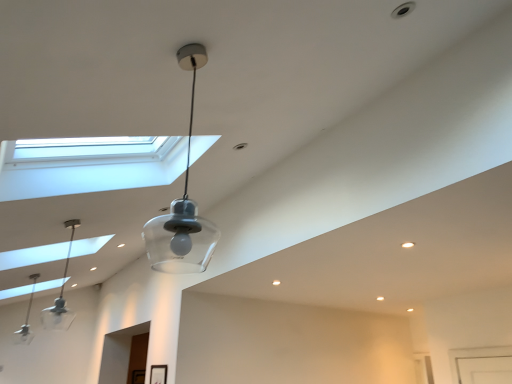
What do you see at coordinates (26, 320) in the screenshot? This screenshot has height=384, width=512. I see `clear glass pendant light at left, positioned as the 1th lamp in left-to-right order` at bounding box center [26, 320].

Describe the element at coordinates (182, 207) in the screenshot. I see `clear glass pendant light at center, the 3th lamp when ordered from bottom to top` at that location.

What is the approximate width of clear glass pendant light at left, which appears as the 2th lamp when viewed from the top?

clear glass pendant light at left, which appears as the 2th lamp when viewed from the top, is 13.94 centimeters in width.

At what (x,y) coordinates should I click in order to perform the action: click on clear glass pendant light at left, positioned as the first lamp in back-to-front order. Please return your answer as a coordinate pair (x, y). The image size is (512, 384). Looking at the image, I should click on (26, 320).

Based on the photo, is clear glass pendant light at left, positioned as the 1th lamp in left-to-right order, oriented away from clear glass pendant light at left, which is counted as the second lamp, starting from the right?

No, clear glass pendant light at left, positioned as the 1th lamp in left-to-right order,'s orientation is not away from clear glass pendant light at left, which is counted as the second lamp, starting from the right.

Which object is wider, clear glass pendant light at left, arranged as the 1th lamp when ordered from the bottom, or clear glass pendant light at left, which appears as the 2th lamp when viewed from the top?

clear glass pendant light at left, arranged as the 1th lamp when ordered from the bottom.

The width and height of the screenshot is (512, 384). I want to click on lamp lying below the clear glass pendant light at left, which is counted as the second lamp, starting from the right (from the image's perspective), so click(x=26, y=320).

Is the position of clear glass pendant light at left, marked as the 3th lamp in a right-to-left arrangement, less distant than that of clear glass pendant light at center, the 1th lamp viewed from the top?

No, clear glass pendant light at left, marked as the 3th lamp in a right-to-left arrangement, is behind clear glass pendant light at center, the 1th lamp viewed from the top.

Locate an element on the screen. The width and height of the screenshot is (512, 384). the 2nd lamp counting from the left of the clear glass pendant light at center, the 3th lamp when ordered from bottom to top is located at coordinates (26, 320).

Is clear glass pendant light at left, positioned as the 3th lamp in front-to-back order, in contact with clear glass pendant light at center, which is the 3th lamp in back-to-front order?

No.

Which of these two, clear glass pendant light at left, positioned as the first lamp in back-to-front order, or clear glass pendant light at center, the 1th lamp viewed from the top, is bigger?

clear glass pendant light at left, positioned as the first lamp in back-to-front order.

Which is in front, clear glass pendant light at left, which is counted as the second lamp, starting from the right, or clear glass pendant light at left, marked as the 3th lamp in a right-to-left arrangement?

clear glass pendant light at left, which is counted as the second lamp, starting from the right.

Find the location of a particular element. lamp that is behind the clear glass pendant light at left, which ranks as the second lamp in back-to-front order is located at coordinates (26, 320).

From the image's perspective, is clear glass pendant light at left, which ranks as the second lamp in back-to-front order, above clear glass pendant light at left, the third lamp in the top-to-bottom sequence?

Correct, clear glass pendant light at left, which ranks as the second lamp in back-to-front order, appears higher than clear glass pendant light at left, the third lamp in the top-to-bottom sequence, in the image.

Do you think clear glass pendant light at left, the 2th lamp from the front, is within clear glass pendant light at center, the 3th lamp when ordered from bottom to top, or outside of it?

clear glass pendant light at left, the 2th lamp from the front, is not enclosed by clear glass pendant light at center, the 3th lamp when ordered from bottom to top.

Between clear glass pendant light at left, the 2th lamp from the front, and clear glass pendant light at center, the 3th lamp when ordered from bottom to top, which one has larger size?

clear glass pendant light at center, the 3th lamp when ordered from bottom to top.

Is clear glass pendant light at left, which appears as the 2th lamp when viewed from the top, not near clear glass pendant light at center, which is the 1th lamp in right-to-left order?

Yes, clear glass pendant light at left, which appears as the 2th lamp when viewed from the top, and clear glass pendant light at center, which is the 1th lamp in right-to-left order, are located far from each other.

How different are the orientations of clear glass pendant light at center, the 1th lamp viewed from the top, and clear glass pendant light at left, the third lamp in the top-to-bottom sequence, in degrees?

clear glass pendant light at center, the 1th lamp viewed from the top, and clear glass pendant light at left, the third lamp in the top-to-bottom sequence, are facing 2.6 degrees away from each other.

Considering the sizes of objects clear glass pendant light at center, the 3th lamp when ordered from bottom to top, and clear glass pendant light at left, marked as the 3th lamp in a right-to-left arrangement, in the image provided, who is smaller, clear glass pendant light at center, the 3th lamp when ordered from bottom to top, or clear glass pendant light at left, marked as the 3th lamp in a right-to-left arrangement,?

Smaller between the two is clear glass pendant light at center, the 3th lamp when ordered from bottom to top.

Does clear glass pendant light at center, which is the 3th lamp in back-to-front order, turn towards clear glass pendant light at left, positioned as the 3th lamp in front-to-back order?

No, clear glass pendant light at center, which is the 3th lamp in back-to-front order, is not facing towards clear glass pendant light at left, positioned as the 3th lamp in front-to-back order.

From a real-world perspective, is clear glass pendant light at center, the 1th lamp viewed from the top, positioned above or below clear glass pendant light at left, positioned as the first lamp in back-to-front order?

Clearly, from a real-world perspective, clear glass pendant light at center, the 1th lamp viewed from the top, is below clear glass pendant light at left, positioned as the first lamp in back-to-front order.

Who is more distant, clear glass pendant light at center, the 3th lamp when ordered from bottom to top, or clear glass pendant light at left, which ranks as the second lamp in back-to-front order?

clear glass pendant light at left, which ranks as the second lamp in back-to-front order.

From the image's perspective, who appears lower, clear glass pendant light at center, which appears as the 1th lamp when viewed from the front, or clear glass pendant light at left, which is counted as the second lamp, starting from the right?

clear glass pendant light at left, which is counted as the second lamp, starting from the right, from the image's perspective.

Is point (188, 54) positioned in front of point (44, 328)?

That is True.

At what (x,y) coordinates should I click in order to perform the action: click on the 1st lamp located beneath the clear glass pendant light at left, positioned as the 1th lamp in left-to-right order (from a real-world perspective). Please return your answer as a coordinate pair (x, y). The width and height of the screenshot is (512, 384). Looking at the image, I should click on [x=61, y=295].

Where is `the 2nd lamp above the clear glass pendant light at left, arranged as the 1th lamp when ordered from the bottom (from the image's perspective)`? The image size is (512, 384). the 2nd lamp above the clear glass pendant light at left, arranged as the 1th lamp when ordered from the bottom (from the image's perspective) is located at coordinates [x=182, y=207].

Based on their spatial positions, is clear glass pendant light at left, which is counted as the 2th lamp, starting from the left, or clear glass pendant light at left, positioned as the first lamp in back-to-front order, closer to clear glass pendant light at center, the 1th lamp viewed from the top?

The object closer to clear glass pendant light at center, the 1th lamp viewed from the top, is clear glass pendant light at left, positioned as the first lamp in back-to-front order.

When comparing their distances from clear glass pendant light at left, which ranks as the second lamp in back-to-front order, does clear glass pendant light at center, which is the 1th lamp in right-to-left order, or clear glass pendant light at left, arranged as the 1th lamp when ordered from the bottom, seem further?

clear glass pendant light at center, which is the 1th lamp in right-to-left order, is further to clear glass pendant light at left, which ranks as the second lamp in back-to-front order.

Considering their positions, is clear glass pendant light at left, which ranks as the second lamp in back-to-front order, positioned closer to clear glass pendant light at left, the third lamp in the top-to-bottom sequence, than clear glass pendant light at center, the 1th lamp viewed from the top?

The object closer to clear glass pendant light at left, the third lamp in the top-to-bottom sequence, is clear glass pendant light at left, which ranks as the second lamp in back-to-front order.

When comparing their distances from clear glass pendant light at left, which ranks as the second lamp in back-to-front order, does clear glass pendant light at left, arranged as the 1th lamp when ordered from the bottom, or clear glass pendant light at center, the 3th lamp when ordered from bottom to top, seem closer?

The object closer to clear glass pendant light at left, which ranks as the second lamp in back-to-front order, is clear glass pendant light at left, arranged as the 1th lamp when ordered from the bottom.

Based on their spatial positions, is clear glass pendant light at left, positioned as the 1th lamp in left-to-right order, or clear glass pendant light at left, which is counted as the 2th lamp, starting from the left, further from clear glass pendant light at center, which is the 3th lamp in back-to-front order?

clear glass pendant light at left, which is counted as the 2th lamp, starting from the left, lies further to clear glass pendant light at center, which is the 3th lamp in back-to-front order, than the other object.

Considering their positions, is clear glass pendant light at center, which is the 3th lamp in back-to-front order, positioned further to clear glass pendant light at left, marked as the 3th lamp in a right-to-left arrangement, than clear glass pendant light at left, which is counted as the 2th lamp, starting from the left?

clear glass pendant light at center, which is the 3th lamp in back-to-front order, lies further to clear glass pendant light at left, marked as the 3th lamp in a right-to-left arrangement, than the other object.

At what (x,y) coordinates should I click in order to perform the action: click on lamp between clear glass pendant light at center, which appears as the third lamp when viewed from the left, and clear glass pendant light at left, the third lamp in the top-to-bottom sequence, in the front-back direction. Please return your answer as a coordinate pair (x, y). This screenshot has width=512, height=384. Looking at the image, I should click on (61, 295).